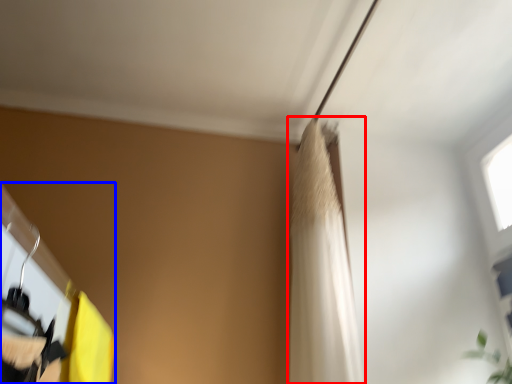
Question: Which object appears closest to the camera in this image, shower curtain (highlighted by a red box) or closet (highlighted by a blue box)?

Choices:
 (A) shower curtain
 (B) closet

Answer: (B)